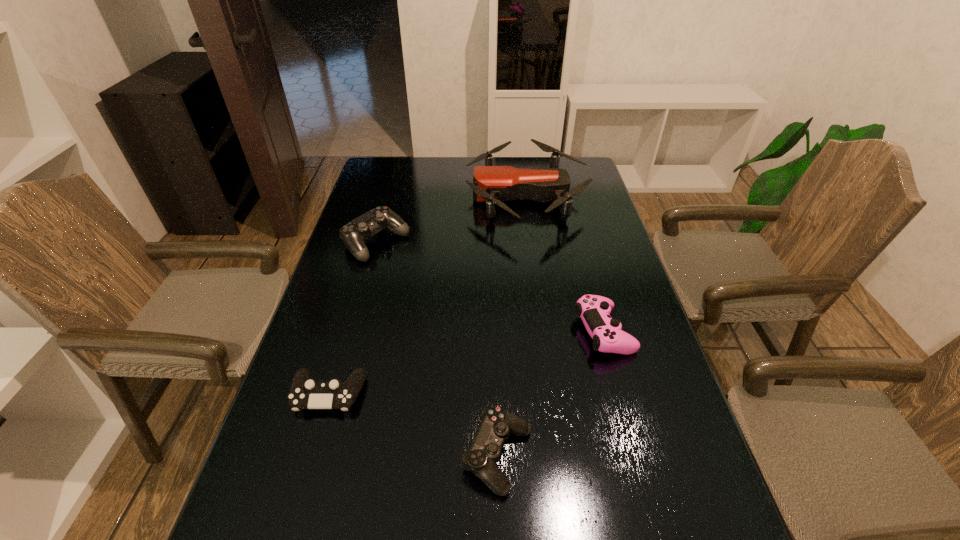
Where is `vacant space located on the front-facing side of the tallest object`? vacant space located on the front-facing side of the tallest object is located at coordinates (366, 197).

The width and height of the screenshot is (960, 540). I want to click on vacant space located 0.180m on the front-facing side of the tallest object, so point(416,197).

At what (x,y) coordinates should I click in order to perform the action: click on vacant space situated on the back of the farthest control. Please return your answer as a coordinate pair (x, y). This screenshot has height=540, width=960. Looking at the image, I should click on (390, 194).

I want to click on free space located on the left of the rightmost control, so click(x=516, y=332).

Find the location of `free location located 0.210m on the back of the nearest control`. free location located 0.210m on the back of the nearest control is located at coordinates (494, 342).

The height and width of the screenshot is (540, 960). Identify the location of vacant space located 0.140m on the surface of the third farthest control. (302, 482).

Find the location of a particular element. This screenshot has width=960, height=540. object at the far edge is located at coordinates (492, 184).

The height and width of the screenshot is (540, 960). Find the location of `drone that is at the right edge`. drone that is at the right edge is located at coordinates (492, 184).

Identify the location of control present at the right edge. (594, 310).

Identify the location of object that is positioned at the far right corner. (492, 184).